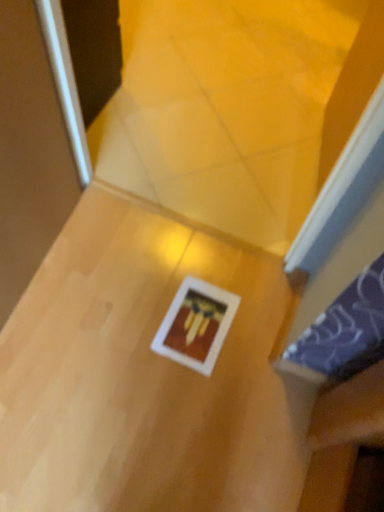
Identify the location of free spot above white matte picture frame at center (from a real-world perspective). The width and height of the screenshot is (384, 512). (197, 326).